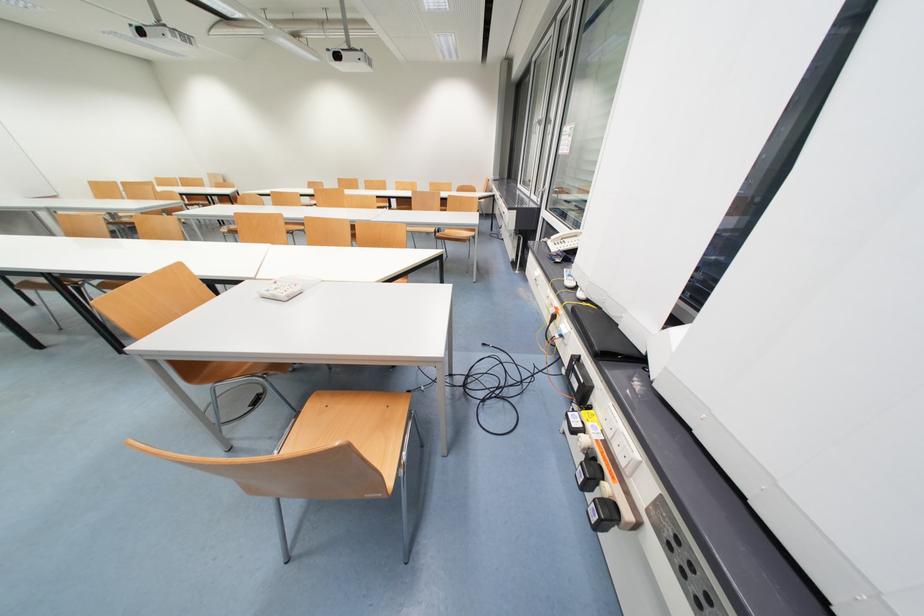
Where is `white power switch`? white power switch is located at coordinates (551, 333).